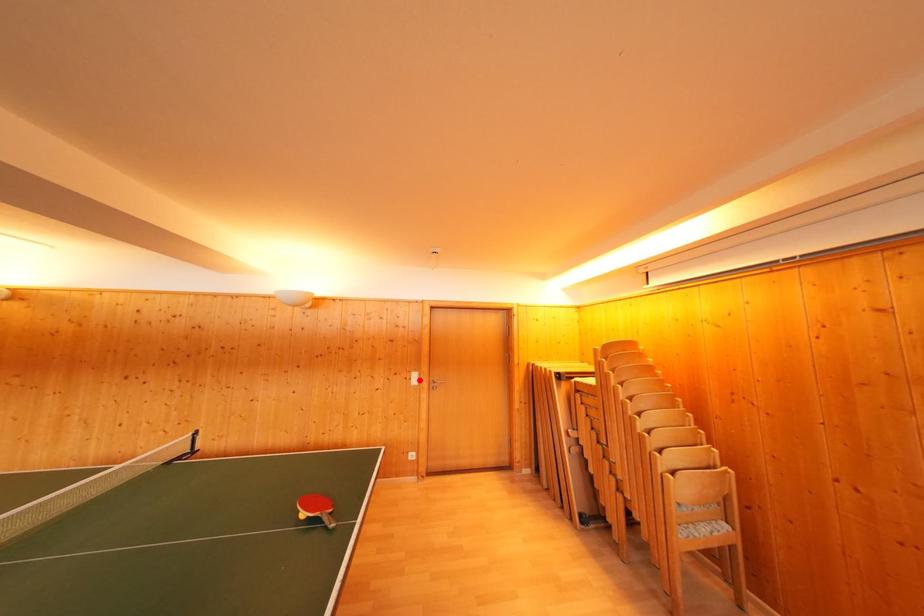
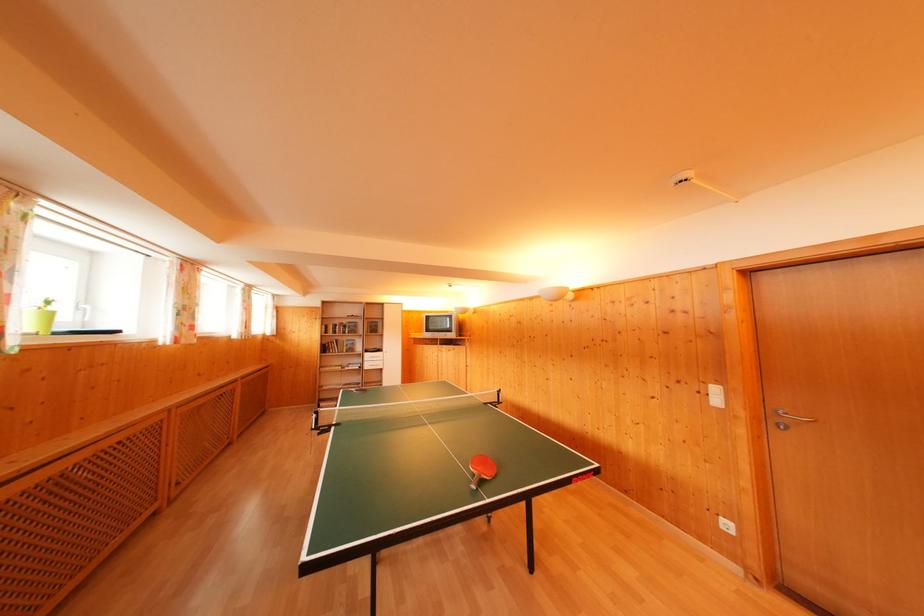
The point at the highlighted location is marked in the first image. Where is the corresponding point in the second image?

(721, 395)